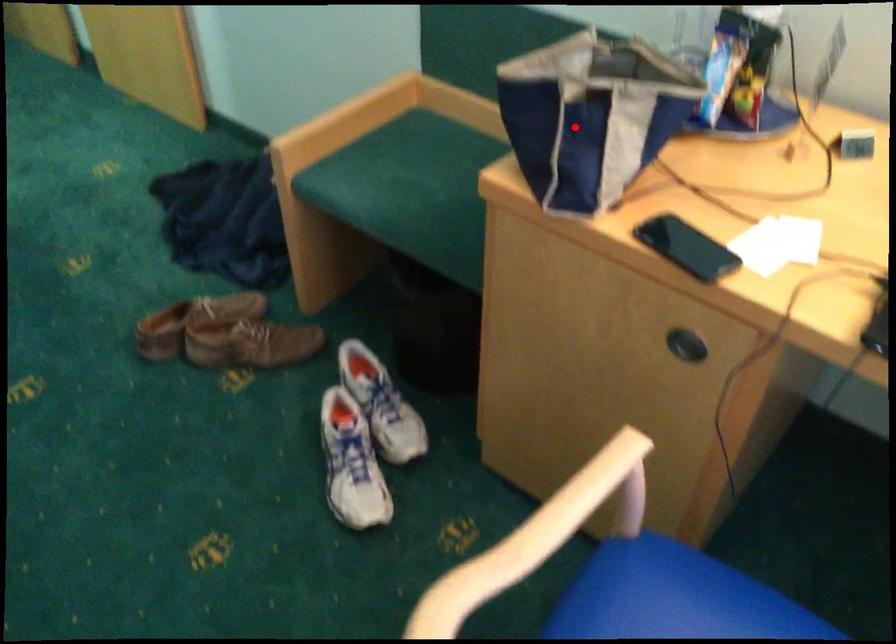
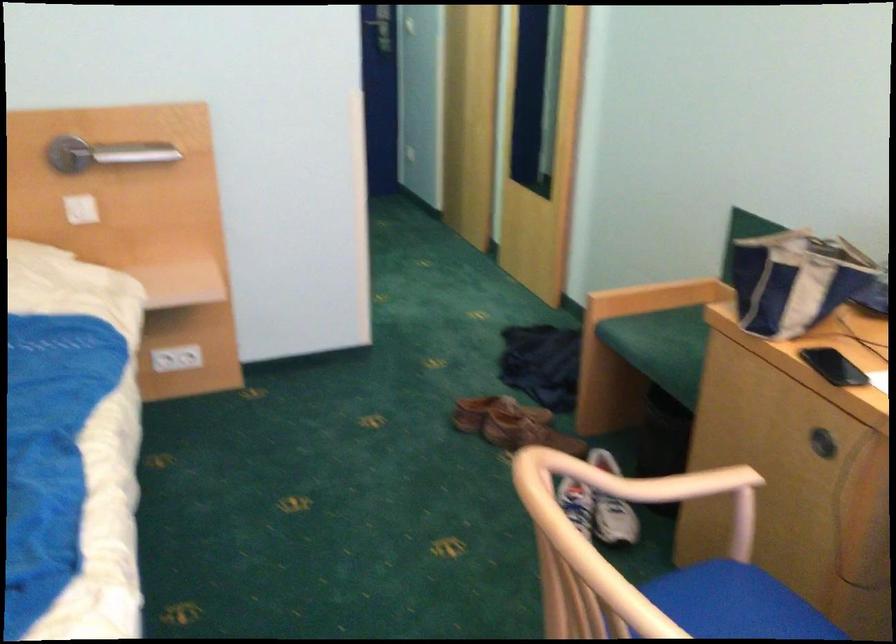
Question: I am providing you with two images of the same scene from different viewpoints. Given a red point in image1, look at the same physical point in image2. Is it:

Choices:
 (A) Closer to the viewpoint
 (B) Farther from the viewpoint

Answer: (B)